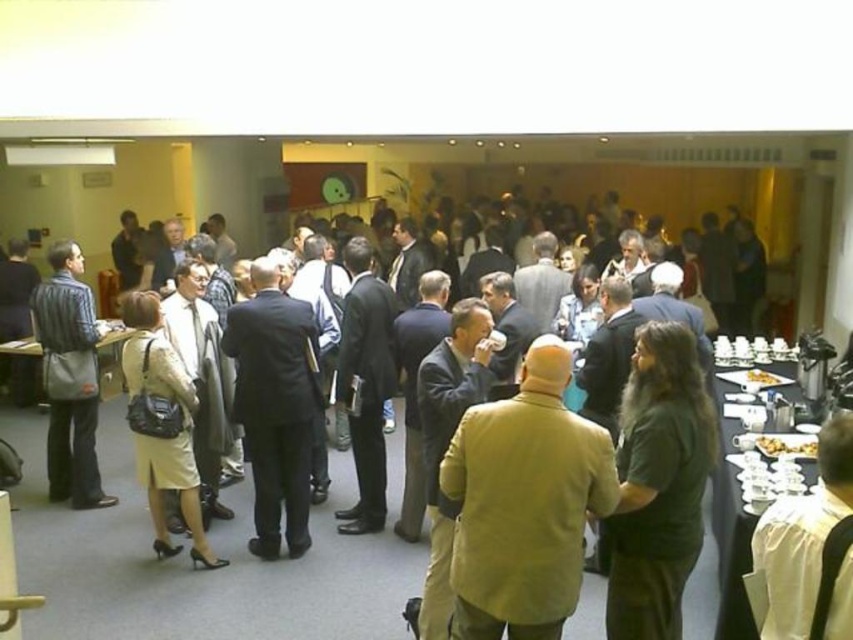
Question: Which object appears closest to the camera in this image?

Choices:
 (A) light beige fabric dress at left
 (B) dark green shirt at center
 (C) matte yellow jacket at center
 (D) black plastic table at right

Answer: (C)

Question: Can you confirm if matte yellow jacket at center is bigger than dark suit at center?

Choices:
 (A) yes
 (B) no

Answer: (B)

Question: Can you confirm if matte yellow jacket at center is bigger than black plastic table at right?

Choices:
 (A) yes
 (B) no

Answer: (A)

Question: Which object appears closest to the camera in this image?

Choices:
 (A) dark green shirt at center
 (B) black plastic table at right
 (C) light beige fabric dress at left
 (D) matte black bag at left

Answer: (A)

Question: Is dark green shirt at center wider than black plastic table at right?

Choices:
 (A) no
 (B) yes

Answer: (A)

Question: Which of the following is the farthest from the observer?

Choices:
 (A) black plastic table at right
 (B) matte black bag at left
 (C) matte yellow jacket at center

Answer: (B)